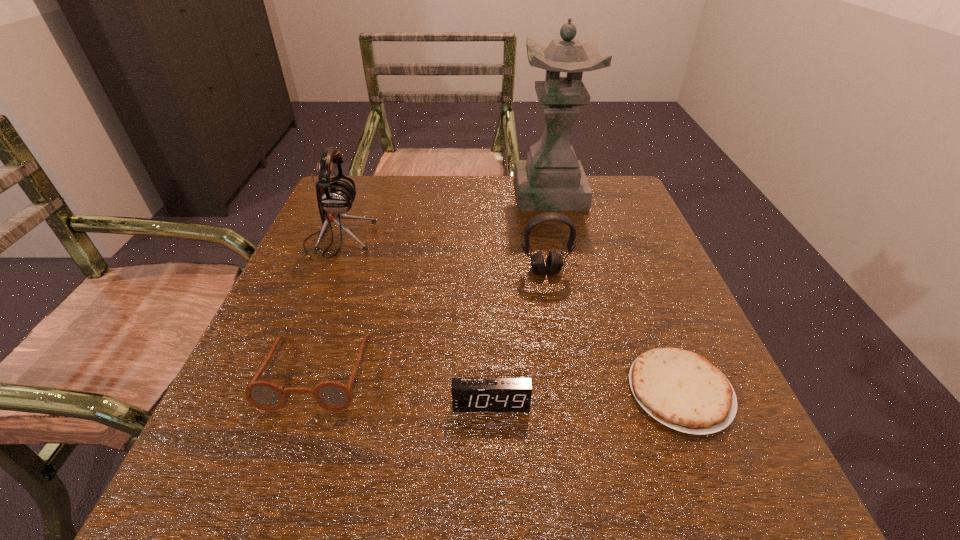
Where is `vacant area at the far right corner`? This screenshot has width=960, height=540. vacant area at the far right corner is located at coordinates (628, 185).

Identify the location of vacant space at the near right corner. The width and height of the screenshot is (960, 540). (677, 507).

You are a GUI agent. You are given a task and a screenshot of the screen. Output one action in this format:
    pyautogui.click(x=<x>, y=<y>)
    Task: Click on the free spot between the farthest object and the spectacles
    
    Given the screenshot: What is the action you would take?
    pyautogui.click(x=434, y=282)

Where is `vacant space that's between the farthest object and the shortest object`? Image resolution: width=960 pixels, height=540 pixels. vacant space that's between the farthest object and the shortest object is located at coordinates (615, 292).

Identify the location of vacant point located between the fourth object from right to left and the spectacles. (404, 387).

This screenshot has width=960, height=540. I want to click on free point between the fifth nearest object and the shortest object, so click(x=509, y=315).

This screenshot has height=540, width=960. Find the location of `free spot between the spectacles and the earphone`. free spot between the spectacles and the earphone is located at coordinates (327, 305).

You are a GUI agent. You are given a task and a screenshot of the screen. Output one action in this format:
    pyautogui.click(x=<x>, y=<y>)
    Task: Click on the free point between the farthest object and the tortilla
    This screenshot has height=540, width=960.
    Given the screenshot: What is the action you would take?
    pyautogui.click(x=615, y=292)

Locate an element on the screen. The height and width of the screenshot is (540, 960). free space that is in between the spectacles and the alarm clock is located at coordinates (404, 387).

Image resolution: width=960 pixels, height=540 pixels. I want to click on vacant space that is in between the alarm clock and the third tallest object, so click(x=518, y=338).